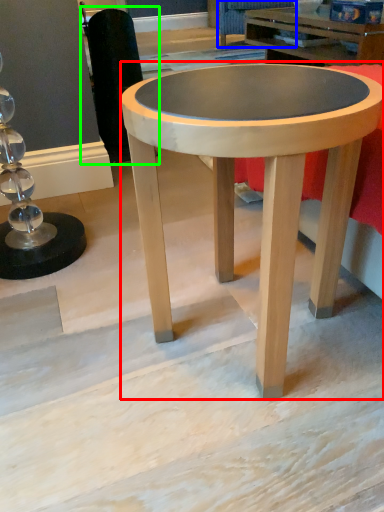
Question: Which object is the closest to the coffee table (highlighted by a red box)? Choose among these: swivel chair (highlighted by a blue box) or swivel chair (highlighted by a green box).

Choices:
 (A) swivel chair
 (B) swivel chair

Answer: (B)